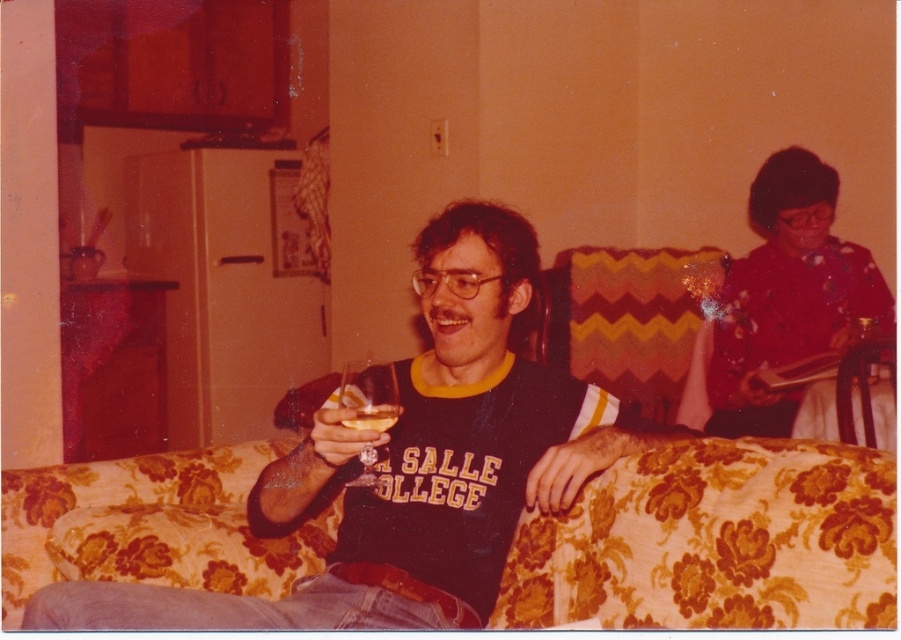
Question: Which of these objects is positioned farthest from the black matte t-shirt at center?

Choices:
 (A) clear glass wine glass at center
 (B) translucent glass at center

Answer: (B)

Question: From the image, what is the correct spatial relationship of black matte t-shirt at center in relation to clear glass wine glass at center?

Choices:
 (A) below
 (B) above

Answer: (A)

Question: Is black matte t-shirt at center positioned at the back of clear glass wine glass at center?

Choices:
 (A) no
 (B) yes

Answer: (A)

Question: Can you confirm if black matte t-shirt at center is positioned to the right of translucent glass at center?

Choices:
 (A) yes
 (B) no

Answer: (B)

Question: Which object appears farthest from the camera in this image?

Choices:
 (A) clear glass wine glass at center
 (B) translucent glass at center

Answer: (A)

Question: Which object is positioned farthest from the clear glass wine glass at center?

Choices:
 (A) translucent glass at center
 (B) black matte t-shirt at center

Answer: (B)